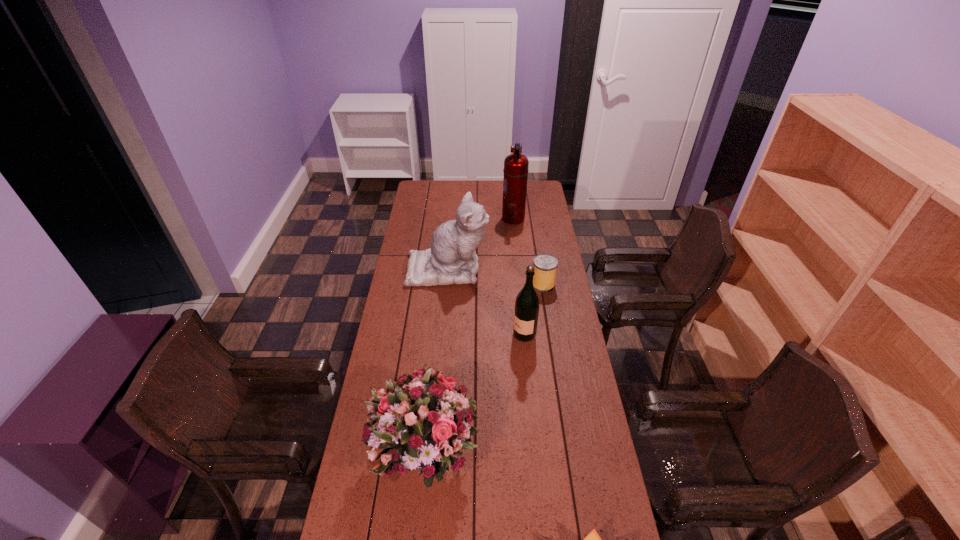
In the image, there is a desktop. Identify the location of vacant area at the right edge. Image resolution: width=960 pixels, height=540 pixels. (594, 469).

Find the location of a particular element. Image resolution: width=960 pixels, height=540 pixels. empty space between the cat and the bouquet is located at coordinates (437, 361).

Identify the location of free area in between the cat and the can. (495, 276).

Find the location of `vacant area between the bouquet and the cat`. vacant area between the bouquet and the cat is located at coordinates (437, 361).

Where is `unoccupied area between the fire extinguisher and the liquor`? The height and width of the screenshot is (540, 960). unoccupied area between the fire extinguisher and the liquor is located at coordinates (518, 276).

What are the coordinates of `vacant area between the fifth farthest object and the farthest object` in the screenshot? It's located at (469, 336).

Identify the location of object that is the second nearest to the can. This screenshot has width=960, height=540. (526, 312).

Identify which object is the second closest to the second nearest object. Please provide its 2D coordinates. Your answer should be formatted as a tuple, i.e. [(x, y)], where the tuple contains the x and y coordinates of a point satisfying the conditions above.

[(526, 312)]

This screenshot has height=540, width=960. I want to click on free space that satisfies the following two spatial constraints: 1. on the back side of the can; 2. on the nozzle side of the farthest object, so click(532, 218).

This screenshot has width=960, height=540. Find the location of `free space in the image that satisfies the following two spatial constraints: 1. on the front-facing side of the cat; 2. on the back side of the can`. free space in the image that satisfies the following two spatial constraints: 1. on the front-facing side of the cat; 2. on the back side of the can is located at coordinates (446, 284).